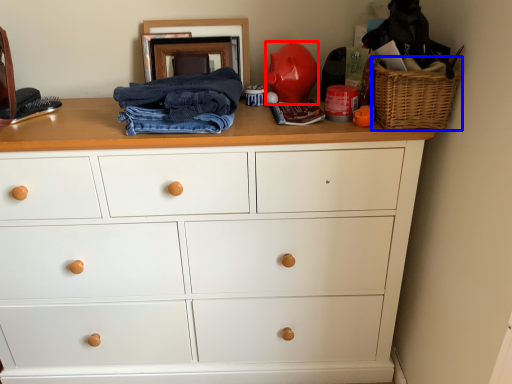
Question: Which point is closer to the camera, toy (highlighted by a red box) or basket (highlighted by a blue box)?

Choices:
 (A) toy
 (B) basket

Answer: (B)